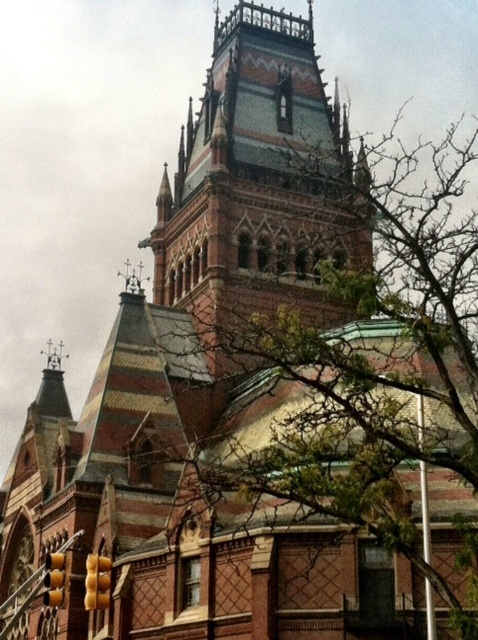
Question: Which point is farther to the camera?

Choices:
 (A) green leafy tree at upper center
 (B) reddish-brown brick tower at center

Answer: (B)

Question: Which point is closer to the camera?

Choices:
 (A) reddish-brown brick tower at center
 (B) green leafy tree at upper center

Answer: (B)

Question: Can you confirm if green leafy tree at upper center is positioned to the left of yellow matte traffic light at lower left?

Choices:
 (A) yes
 (B) no

Answer: (B)

Question: Does green leafy tree at upper center appear under yellow plastic traffic light at lower left?

Choices:
 (A) yes
 (B) no

Answer: (B)

Question: Which of the following is the farthest from the observer?

Choices:
 (A) green leafy tree at upper center
 (B) yellow plastic traffic light at lower left
 (C) reddish-brown brick tower at center

Answer: (C)

Question: Is reddish-brown brick tower at center closer to the viewer compared to yellow plastic traffic light at lower left?

Choices:
 (A) no
 (B) yes

Answer: (A)